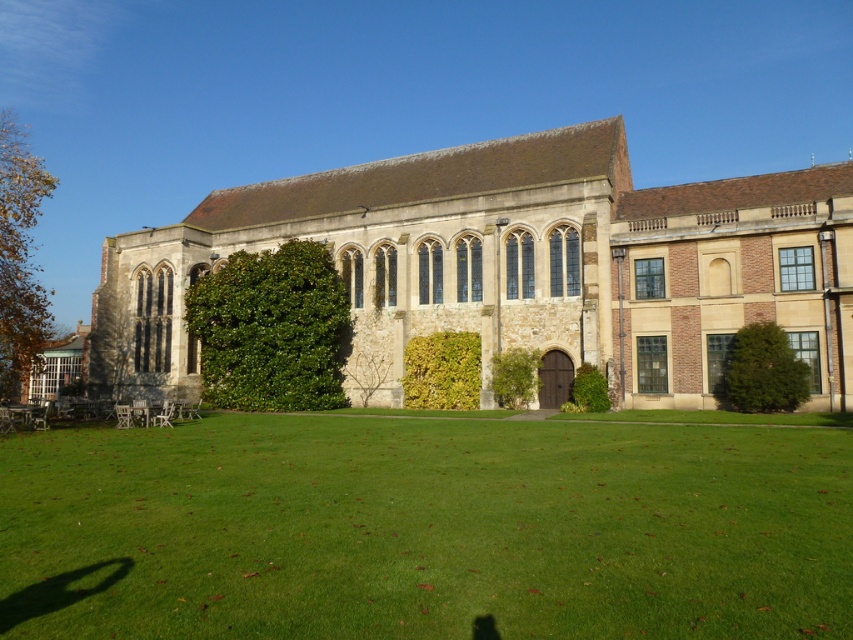
You are standing at the point marked as point (x=424, y=529) on the lawn in front of the historic building. What is the name of the location you are currently standing on?

The point (x=424, y=529) corresponds to the green grass at lower center, so you are standing on the green grass at lower center.